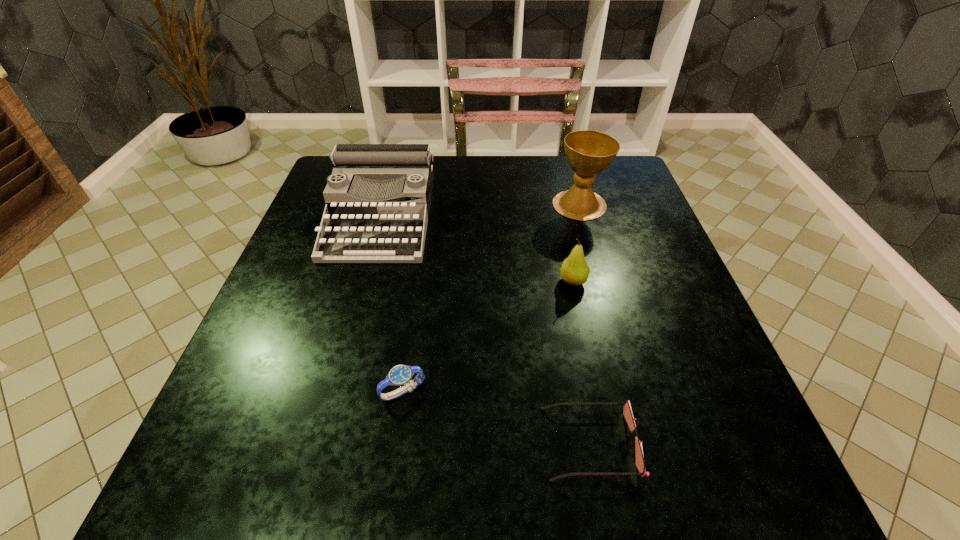
What are the coordinates of `the tallest object` in the screenshot? It's located at (588, 152).

Where is `typewriter`? typewriter is located at coordinates (378, 195).

In order to click on pear in this screenshot , I will do `click(574, 270)`.

You are a GUI agent. You are given a task and a screenshot of the screen. Output one action in this format:
    pyautogui.click(x=<x>, y=<y>)
    Task: Click on the fourth farthest object
    
    Given the screenshot: What is the action you would take?
    pyautogui.click(x=400, y=375)

Identify the location of watch. (400, 375).

You are a GUI agent. You are given a task and a screenshot of the screen. Output one action in this format:
    pyautogui.click(x=<x>, y=<y>)
    Task: Click on the nearest object
    This screenshot has height=540, width=960.
    Given the screenshot: What is the action you would take?
    pyautogui.click(x=627, y=412)

Find the location of `the shortest object`. the shortest object is located at coordinates (627, 412).

Image resolution: width=960 pixels, height=540 pixels. I want to click on vacant space located on the front of the chalice, so click(x=592, y=250).

Where is `vacant space located 0.380m on the typing side of the typewriter`? This screenshot has height=540, width=960. vacant space located 0.380m on the typing side of the typewriter is located at coordinates pos(324,424).

This screenshot has height=540, width=960. In order to click on free space located 0.120m on the right of the pear in this screenshot , I will do `click(644, 281)`.